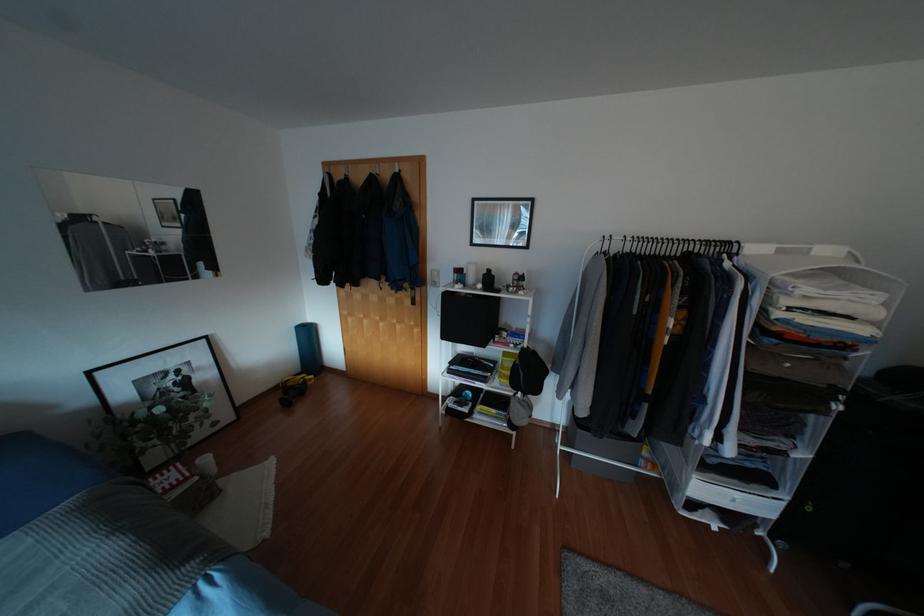
In order to click on metal coat hook in this screenshot , I will do `click(666, 246)`.